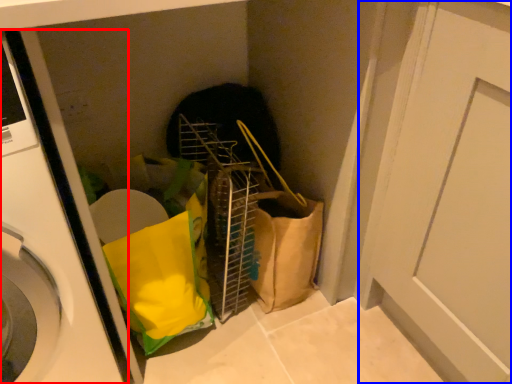
Question: Which object is closer to the camera taking this photo, washing machine (highlighted by a red box) or door (highlighted by a blue box)?

Choices:
 (A) washing machine
 (B) door

Answer: (A)